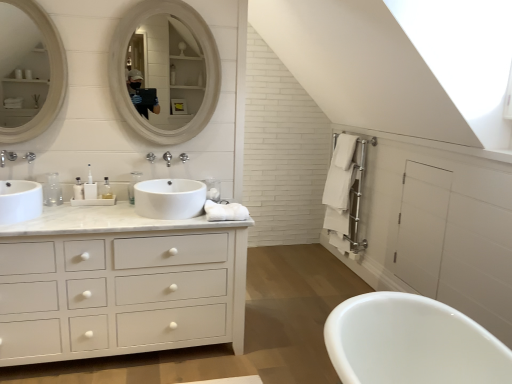
Question: From a real-world perspective, is white glossy sink at center, positioned as the 1th sink in right-to-left order, on top of white glossy mirror at upper center, which is the 1th mirror in right-to-left order?

Choices:
 (A) yes
 (B) no

Answer: (B)

Question: Is white glossy sink at center, positioned as the 1th sink in right-to-left order, oriented away from white glossy mirror at upper center, the second mirror when ordered from left to right?

Choices:
 (A) yes
 (B) no

Answer: (B)

Question: From the image's perspective, is white glossy sink at center, positioned as the 1th sink in right-to-left order, on white glossy mirror at upper center, which is the 1th mirror in right-to-left order?

Choices:
 (A) yes
 (B) no

Answer: (B)

Question: Is white glossy sink at center, arranged as the second sink when viewed from the left, shorter than white glossy mirror at upper center, the second mirror when ordered from left to right?

Choices:
 (A) no
 (B) yes

Answer: (B)

Question: Is white glossy sink at center, positioned as the 1th sink in right-to-left order, positioned behind white glossy mirror at upper center, the second mirror when ordered from left to right?

Choices:
 (A) no
 (B) yes

Answer: (A)

Question: Considering the relative sizes of white glossy sink at center, arranged as the second sink when viewed from the left, and white glossy mirror at upper center, the second mirror when ordered from left to right, in the image provided, is white glossy sink at center, arranged as the second sink when viewed from the left, wider than white glossy mirror at upper center, the second mirror when ordered from left to right,?

Choices:
 (A) no
 (B) yes

Answer: (B)

Question: Does white wooden mirror at upper left, the 1th mirror viewed from the left, have a larger size compared to white glossy sink at center, arranged as the second sink when viewed from the left?

Choices:
 (A) yes
 (B) no

Answer: (B)

Question: Does white wooden mirror at upper left, the 1th mirror viewed from the left, appear on the left side of white glossy sink at center, arranged as the second sink when viewed from the left?

Choices:
 (A) no
 (B) yes

Answer: (B)

Question: Is white wooden mirror at upper left, the 1th mirror viewed from the left, smaller than white glossy sink at center, arranged as the second sink when viewed from the left?

Choices:
 (A) yes
 (B) no

Answer: (A)

Question: From the image's perspective, is white wooden mirror at upper left, marked as the 2th mirror in a right-to-left arrangement, under white glossy sink at center, arranged as the second sink when viewed from the left?

Choices:
 (A) no
 (B) yes

Answer: (A)

Question: From the image's perspective, does white wooden mirror at upper left, marked as the 2th mirror in a right-to-left arrangement, appear higher than white glossy sink at center, arranged as the second sink when viewed from the left?

Choices:
 (A) yes
 (B) no

Answer: (A)

Question: Considering the relative sizes of white wooden mirror at upper left, marked as the 2th mirror in a right-to-left arrangement, and white glossy sink at center, arranged as the second sink when viewed from the left, in the image provided, is white wooden mirror at upper left, marked as the 2th mirror in a right-to-left arrangement, wider than white glossy sink at center, arranged as the second sink when viewed from the left,?

Choices:
 (A) no
 (B) yes

Answer: (A)

Question: Is clear plastic bottle at center, which ranks as the 2th toiletry in right-to-left order, closer to camera compared to white glossy sink at left, positioned as the second sink in right-to-left order?

Choices:
 (A) no
 (B) yes

Answer: (A)